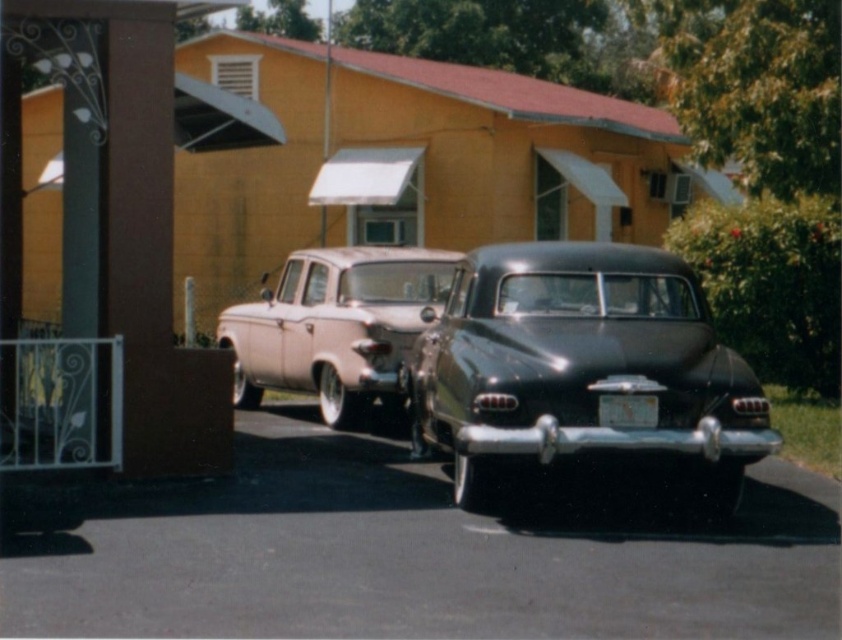
You are a car enthusiast who wants to park a new car that is 1.8 meters tall. You see the shiny black sedan at center and the light pink glossy sedan at center in the image. Can your new car fit in the parking spot between them if the height limit is based on the shorter vehicle?

The light pink glossy sedan at center is shorter than the shiny black sedan at center. Since the height limit is based on the shorter vehicle, your new car that is 1.8 meters tall can fit in the parking spot between them only if the light pink glossy sedan at center is taller than 1.8 meters. However, since the shiny black sedan at center is taller, the height limit would be determined by the light pink glossy sedan at center. If the light pink glossy sedan at center is shorter than 1.8 meters, your car may

You are standing 20 feet away from the point at coordinates point (707, 500). Can you see the entire yellow building with a red roof behind the cars?

The distance of point (707, 500) from viewer is 26.53 feet. Since you are standing 20 feet away from the point, you are 6.53 feet closer to the point than its actual distance. Therefore, you can see the entire yellow building with a red roof behind the cars.

You are standing in front of the two vintage cars and want to take a photo. You notice two points marked on the cars. The first point is at coordinate point (531, 289) and the second is at point (372, 291). Which point is closer to your camera?

Point (531, 289) is closer to the camera than point (372, 291).